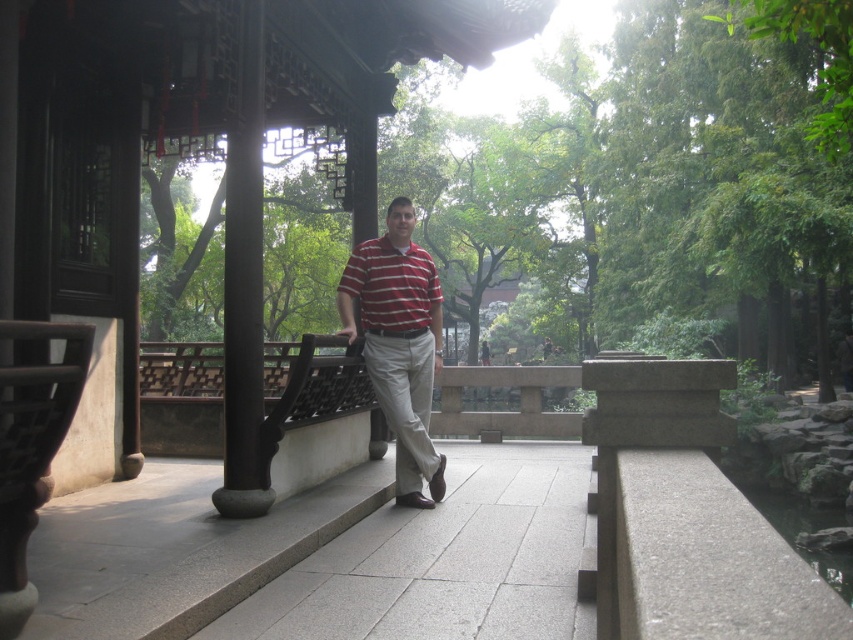
You are a tailor observing a man in a traditional Chinese garden. You need to determine which of the two shirts he is wearing to recommend a matching accessory. The shirts are the matte striped shirt at center and the striped cotton polo shirt at center. Which shirt is larger in size?

The matte striped shirt at center is bigger than the striped cotton polo shirt at center, so the man is wearing the larger matte striped shirt at center.